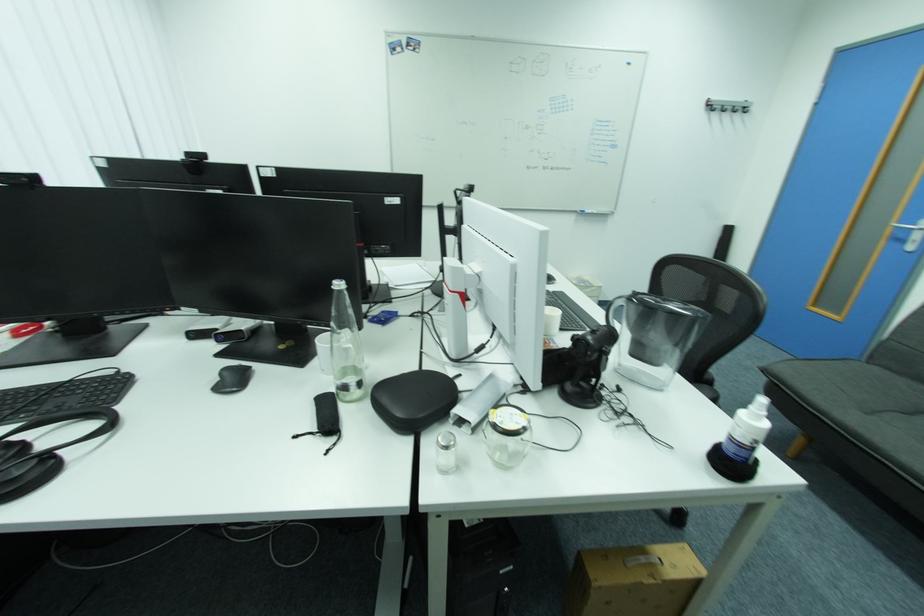
The image size is (924, 616). Describe the element at coordinates (232, 379) in the screenshot. I see `the black computer mouse` at that location.